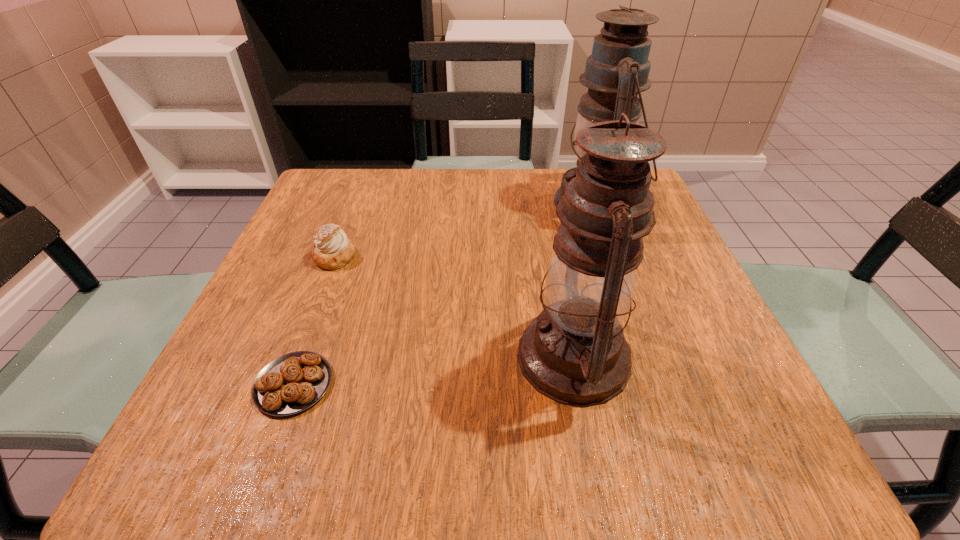
In order to click on the farthest object in this screenshot , I will do `click(617, 71)`.

Find the location of `the nearer oil lamp`. the nearer oil lamp is located at coordinates (574, 352).

Find the location of a particular element. the third nearest object is located at coordinates (332, 250).

Identify the location of the taller pastry. The height and width of the screenshot is (540, 960). (332, 250).

This screenshot has height=540, width=960. What are the coordinates of `the shortest object` in the screenshot? It's located at (293, 382).

The image size is (960, 540). What are the coordinates of `the shorter pastry` in the screenshot? It's located at pyautogui.click(x=293, y=382).

Image resolution: width=960 pixels, height=540 pixels. I want to click on free space located on the front of the farther oil lamp, so click(x=616, y=262).

This screenshot has height=540, width=960. Identify the location of vacant space situated 0.150m on the left of the nearer oil lamp. (422, 357).

At what (x,y) coordinates should I click in order to perform the action: click on vacant region located 0.190m on the right of the taller pastry. Please return your answer as a coordinate pair (x, y). This screenshot has width=960, height=540. Looking at the image, I should click on (449, 257).

The image size is (960, 540). Find the location of `vacant area situated 0.180m on the right of the shorter pastry`. vacant area situated 0.180m on the right of the shorter pastry is located at coordinates (452, 384).